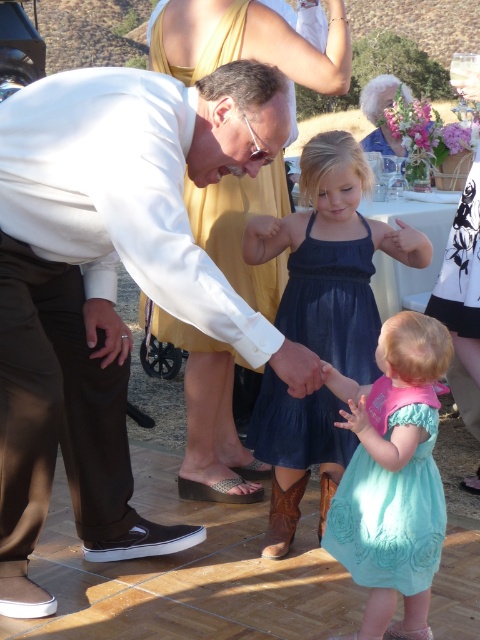
You are standing in the outdoor gathering scene. There are two points marked in the image. Point A is at coordinates point (113, 230) and Point B is at coordinates point (284, 244). Which point is closer to you?

Point A at coordinates point (113, 230) is closer to the viewer than point (284, 244).

You are a photographer at the event and need to ensure all subjects are in frame. The camera has a limited focus range. Which subject should you prioritize focusing on first between the white matte shirt at center and the teal satin dress at lower center?

The white matte shirt at center is smaller than the teal satin dress at lower center, so you should prioritize focusing on the teal satin dress at lower center first since it takes up more space in the frame.

You are taking a photo of the lively outdoor gathering. You want to focus on the point that is closer to the camera. Which point should you choose between point (163, 51) and point (466, 410)?

Point (163, 51) is closer to the camera than point (466, 410), so you should choose point (163, 51) to focus on.